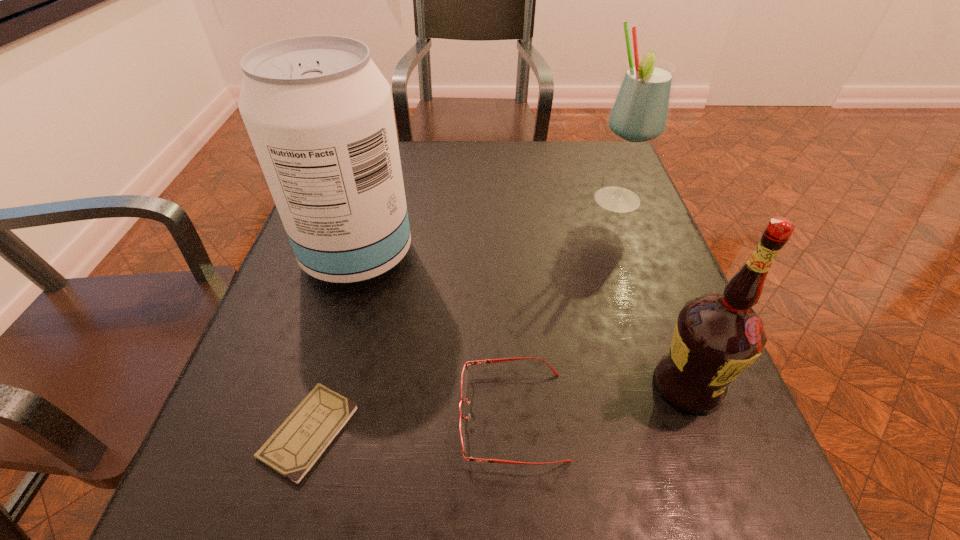
Image resolution: width=960 pixels, height=540 pixels. I want to click on free area in between the second farthest alcohol and the shortest alcohol, so click(522, 320).

Locate an element on the screen. vacant area that lies between the leftmost alcohol and the farthest object is located at coordinates (487, 228).

I want to click on free spot between the shortest object and the second nearest alcohol, so [x=333, y=343].

The width and height of the screenshot is (960, 540). What are the coordinates of `vacant space in between the shortest alcohol and the farthest object` in the screenshot? It's located at (652, 293).

Find the location of `vacant area between the third tallest object and the leftmost alcohol`. vacant area between the third tallest object and the leftmost alcohol is located at coordinates (522, 320).

I want to click on vacant area that lies between the nearest alcohol and the shortest object, so click(x=498, y=408).

The width and height of the screenshot is (960, 540). Find the location of `free area in between the shortest alcohol and the leftmost alcohol`. free area in between the shortest alcohol and the leftmost alcohol is located at coordinates (522, 320).

I want to click on free area in between the farthest alcohol and the second nearest alcohol, so click(x=487, y=228).

Where is `empty location between the shortest alcohol and the farthest alcohol`? empty location between the shortest alcohol and the farthest alcohol is located at coordinates (x=652, y=293).

Locate an element on the screen. The width and height of the screenshot is (960, 540). object that is the closest one to the second farthest alcohol is located at coordinates (464, 376).